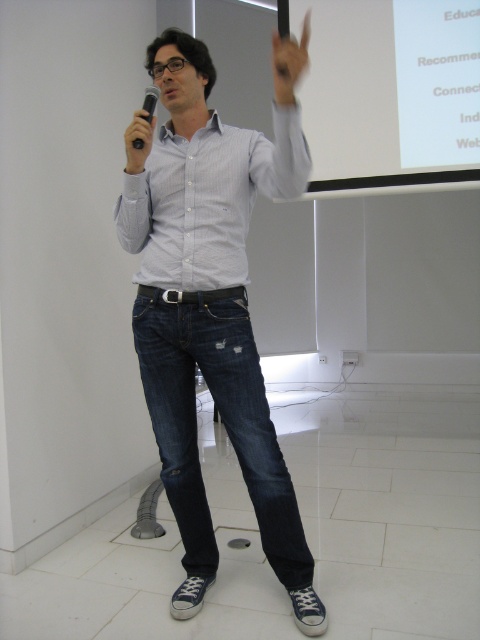
Based on the photo, you are a stagehand setting up for a presentation. You need to place a 1.8 meter tall backdrop between the denim jeans at center and the white matte projection screen at upper center. Considering their heights, which object should the backdrop be placed closer to?

The denim jeans at center is much taller than the white matte projection screen at upper center. Therefore, the backdrop should be placed closer to the white matte projection screen at upper center to accommodate the height difference.

You are a stagehand setting up for a presentation. You need to position a new projector so that its beam can reach the white matte projection screen at upper center without hitting the dark blue denim jeans at center. Based on their positions, can you determine if this is possible?

The white matte projection screen at upper center is to the right of the dark blue denim jeans at center, so the projector beam can be angled to the right to avoid hitting the jeans and reach the screen.

You are a stagehand setting up for a presentation. You need to ensure the projection screen is visible to the audience while the presenter is standing. Based on the scene, is the white matte projection screen at upper center positioned above or below the dark blue denim jeans at center?

The white matte projection screen at upper center is located above the dark blue denim jeans at center, so it is positioned above.